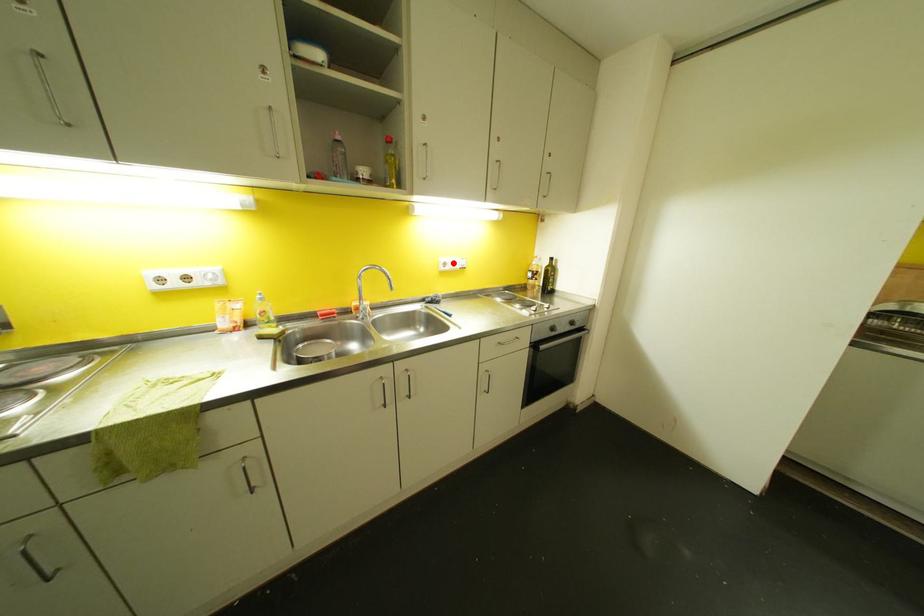
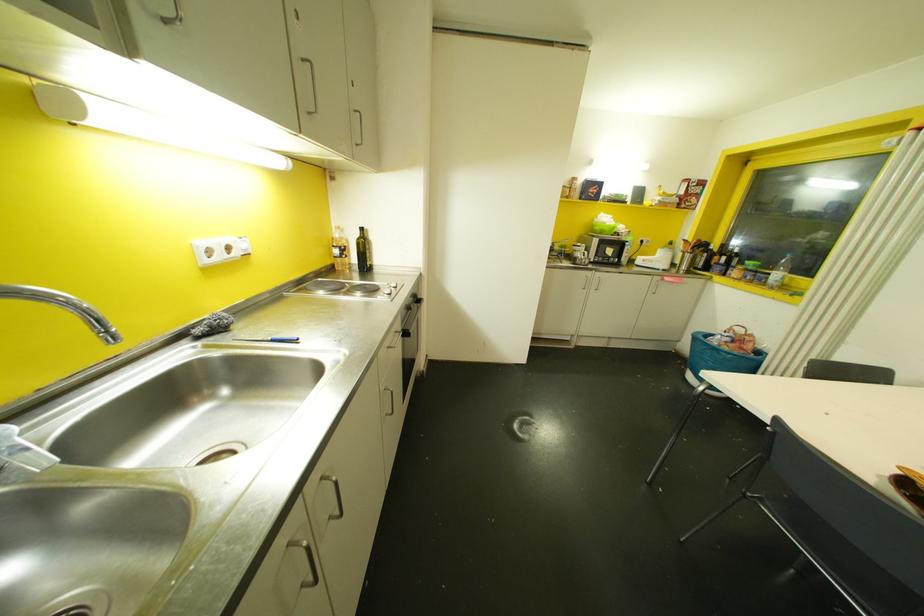
In the second image, find the point that corresponds to the highlighted location in the first image.

(227, 248)